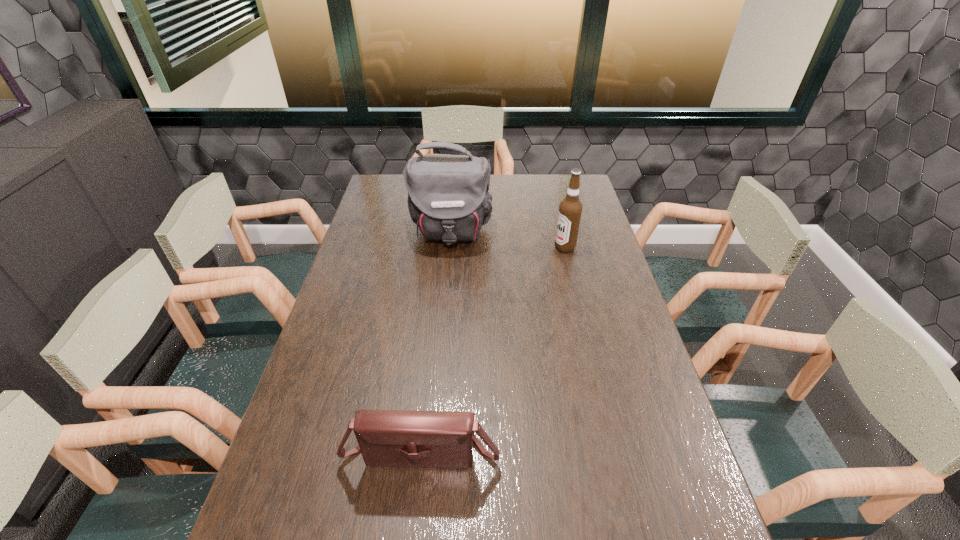
The image size is (960, 540). In order to click on the taller shoulder bag in this screenshot , I will do `click(448, 199)`.

Where is `the rightmost object`? This screenshot has height=540, width=960. the rightmost object is located at coordinates (570, 209).

Identify the location of the shortest object. The image size is (960, 540). tap(394, 438).

The image size is (960, 540). I want to click on the shorter shoulder bag, so click(394, 438).

Locate an element on the screen. This screenshot has width=960, height=540. free space located 0.260m on the open flap of the farther shoulder bag is located at coordinates (444, 307).

At what (x,y) coordinates should I click in order to perform the action: click on vacant space located 0.200m on the label of the alcohol. Please return your answer as a coordinate pair (x, y). Looking at the image, I should click on (499, 247).

This screenshot has height=540, width=960. Find the location of `blank space located on the label of the alcohol`. blank space located on the label of the alcohol is located at coordinates (458, 247).

The width and height of the screenshot is (960, 540). Identify the location of free point located 0.400m on the label of the alcohol. (444, 247).

Identify the location of vacant region located 0.110m on the front flap of the nearest object. (413, 528).

The image size is (960, 540). What are the coordinates of `object that is at the left edge` in the screenshot? It's located at (394, 438).